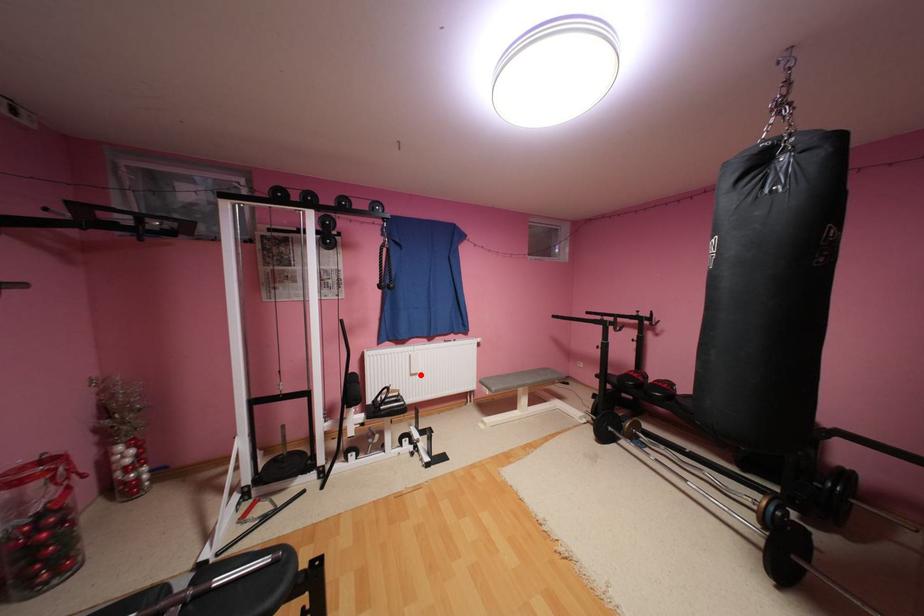
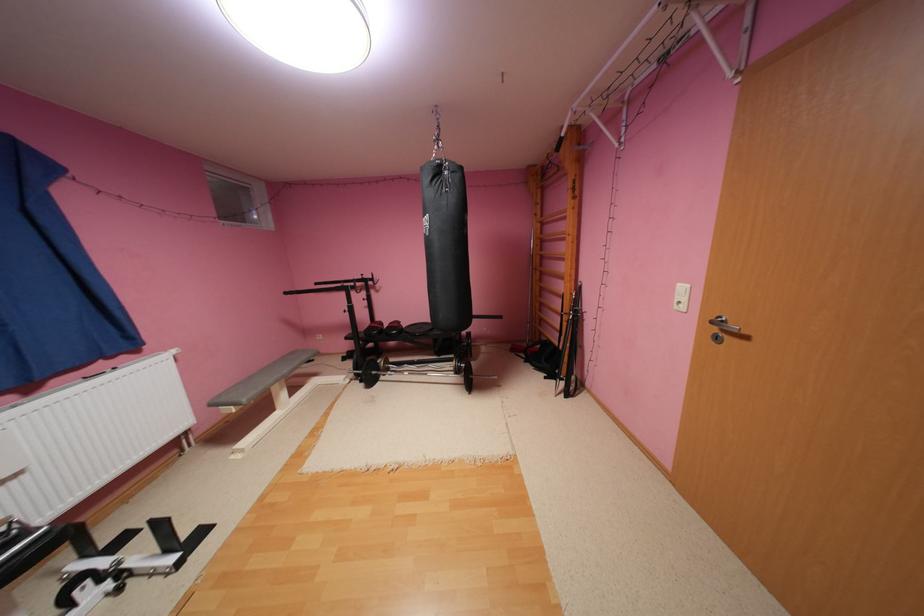
Where in the second image is the point corresponding to the highlighted location from the first image?

(11, 483)